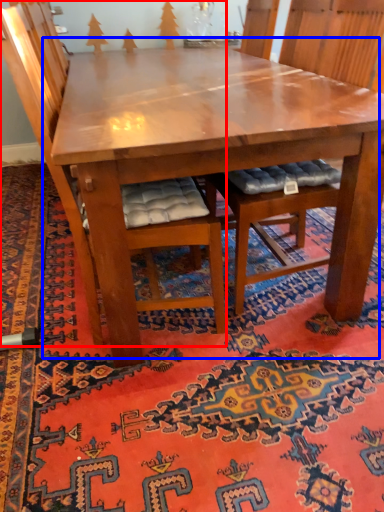
Question: Which object is further to the camera taking this photo, chair (highlighted by a red box) or table (highlighted by a blue box)?

Choices:
 (A) chair
 (B) table

Answer: (B)